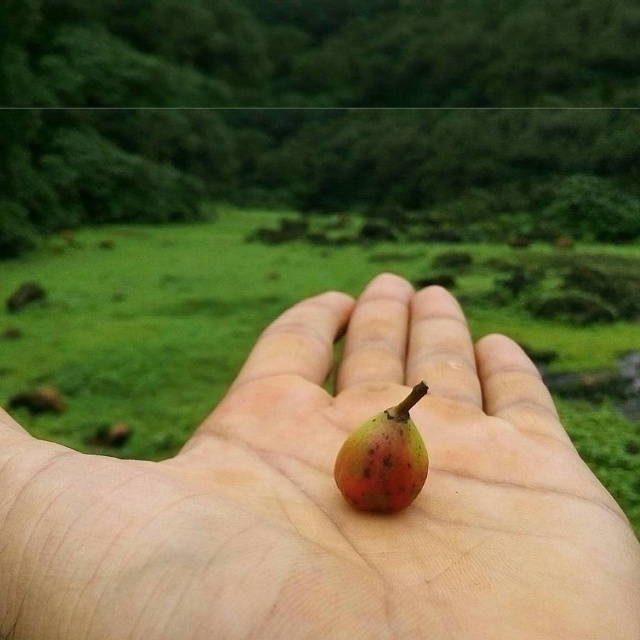
Question: Observing the image, what is the correct spatial positioning of smooth skin palm at center in reference to ripe red-orange fruit at center?

Choices:
 (A) below
 (B) above

Answer: (B)

Question: Where is smooth skin palm at center located in relation to ripe red-orange fruit at center in the image?

Choices:
 (A) above
 (B) below

Answer: (A)

Question: Which point is farther from the camera taking this photo?

Choices:
 (A) (376, 477)
 (B) (557, 602)

Answer: (A)

Question: Can you confirm if smooth skin palm at center is wider than ripe red-orange fruit at center?

Choices:
 (A) no
 (B) yes

Answer: (B)

Question: Which of the following is the farthest from the observer?

Choices:
 (A) smooth skin palm at center
 (B) ripe red-orange fruit at center

Answer: (B)

Question: Which object appears farthest from the camera in this image?

Choices:
 (A) ripe red-orange fruit at center
 (B) smooth skin palm at center

Answer: (A)